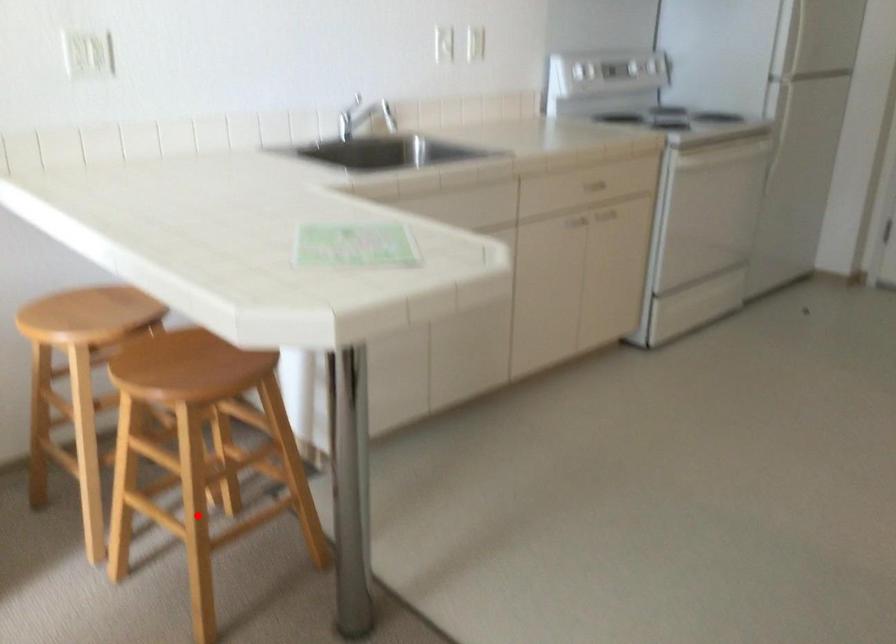
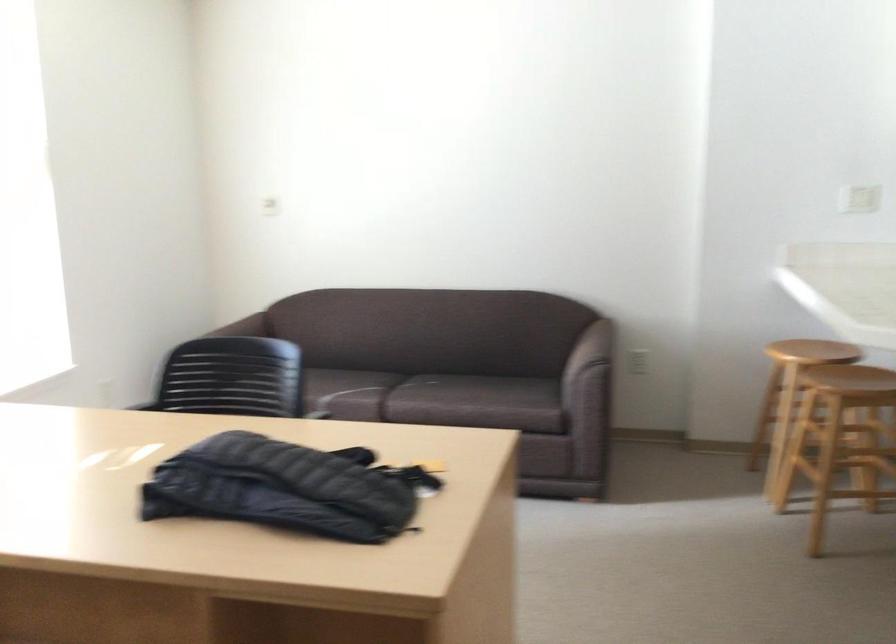
Question: I am providing you with two images of the same scene from different viewpoints. Image1 has a red point marked. In image2, the corresponding 3D location appears at what relative position? Reply with the corresponding letter.

Choices:
 (A) Closer
 (B) Farther

Answer: (B)